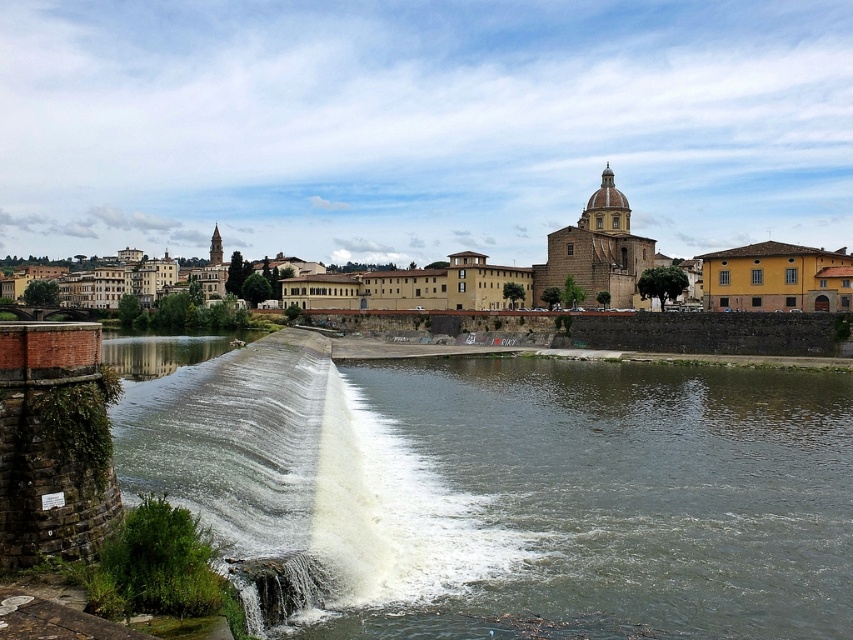
You are standing at the riverside and see two points marked in the image. The first point is at coordinates point (306,516) and the second is at point (572,256). Which point is closer to you?

Point (306,516) is in front of point (572,256), so it is closer to you.

What is located at the coordinate point (306, 481) in the image?

The point (306, 481) corresponds to white frothy water at center.

You are standing at point A at point (314, 634) and want to walk to point B. The distance between them is 163.24 feet. If you walk at 3 feet per second, how long will it take you to reach point B?

The distance between point A at point (314, 634) and point B is 163.24 feet. At a walking speed of 3 feet per second, it will take approximately 54.41 seconds to reach point B.